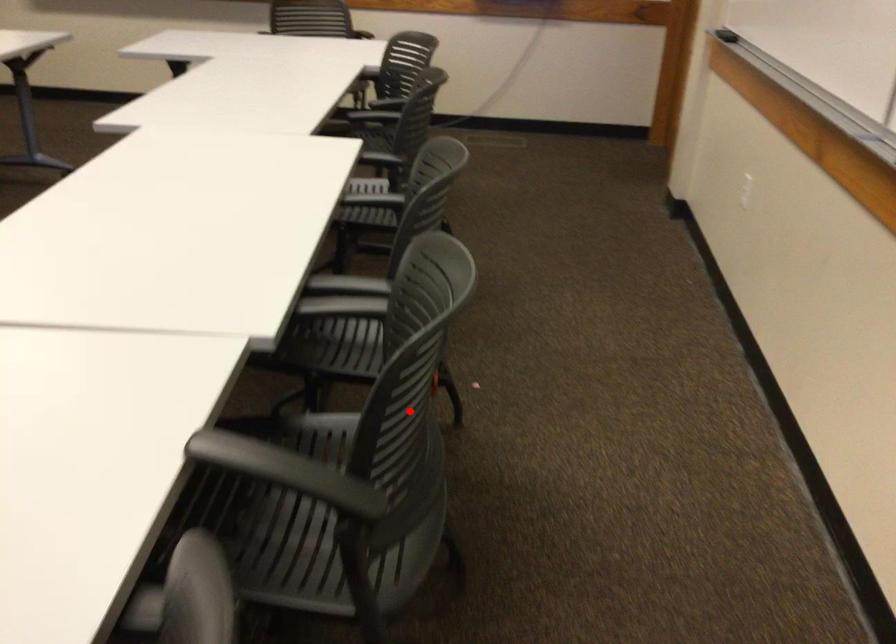
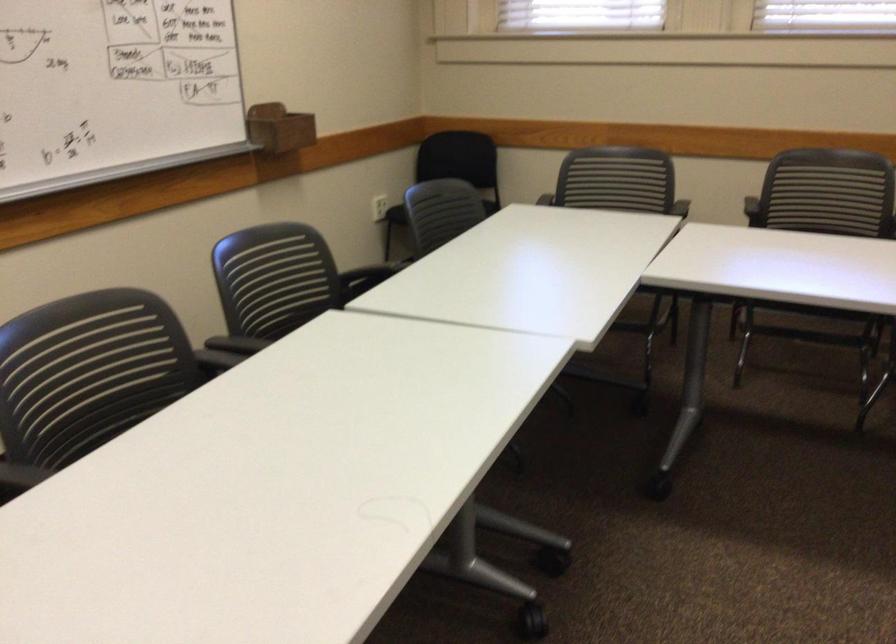
Question: I am providing you with two images of the same scene from different viewpoints. In image1, a red point is highlighted. Considering the same 3D point in image2, which of the following is correct?

Choices:
 (A) It is closer
 (B) It is farther

Answer: (B)